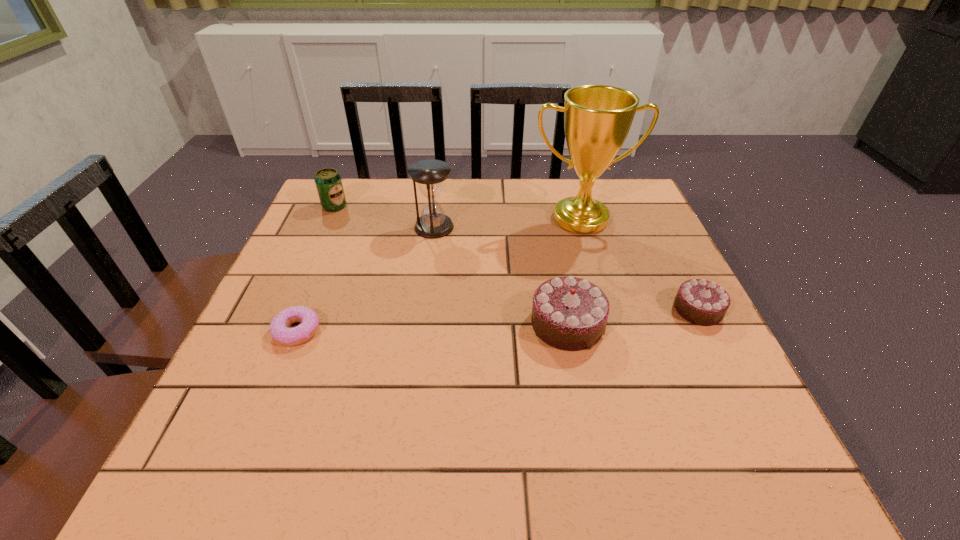
The image size is (960, 540). Find the location of `free spot that satisfies the following two spatial constraints: 1. on the front side of the beer can; 2. on the left side of the doughnut`. free spot that satisfies the following two spatial constraints: 1. on the front side of the beer can; 2. on the left side of the doughnut is located at coordinates (278, 332).

The width and height of the screenshot is (960, 540). I want to click on vacant region that satisfies the following two spatial constraints: 1. on the front side of the beer can; 2. on the right side of the shortest object, so click(278, 332).